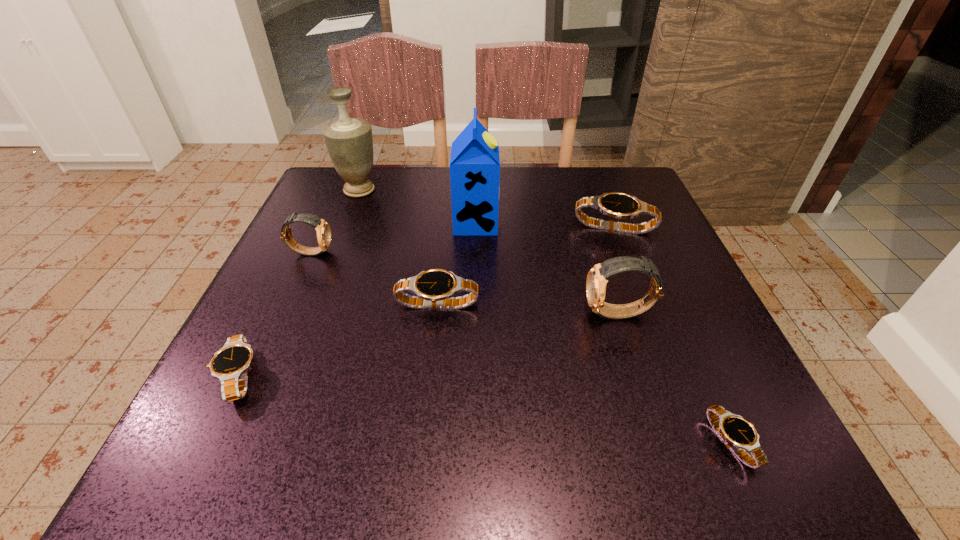
Select which black watch is the fourth closest to the second tallest watch. Please provide its 2D coordinates. Your answer should be formatted as a tuple, i.e. [(x, y)], where the tuple contains the x and y coordinates of a point satisfying the conditions above.

[(739, 434)]

Locate which black watch is the fourth closest to the urn. Please provide its 2D coordinates. Your answer should be formatted as a tuple, i.e. [(x, y)], where the tuple contains the x and y coordinates of a point satisfying the conditions above.

[(739, 434)]

Where is `vacant area that satisfies the following two spatial constraints: 1. on the back side of the second smallest black watch; 2. on the left side of the farthest watch`? This screenshot has height=540, width=960. vacant area that satisfies the following two spatial constraints: 1. on the back side of the second smallest black watch; 2. on the left side of the farthest watch is located at coordinates (312, 228).

Find the location of `free region that satisfies the following two spatial constraints: 1. on the front side of the biggest black watch; 2. on the face of the nearer gold watch`. free region that satisfies the following two spatial constraints: 1. on the front side of the biggest black watch; 2. on the face of the nearer gold watch is located at coordinates (647, 314).

Image resolution: width=960 pixels, height=540 pixels. Identify the location of free space that satisfies the following two spatial constraints: 1. on the face of the right gold watch; 2. on the right side of the shortest object. (660, 442).

Locate an element on the screen. The width and height of the screenshot is (960, 540). free region that satisfies the following two spatial constraints: 1. on the face of the nearest object; 2. on the left side of the third tallest object is located at coordinates (660, 442).